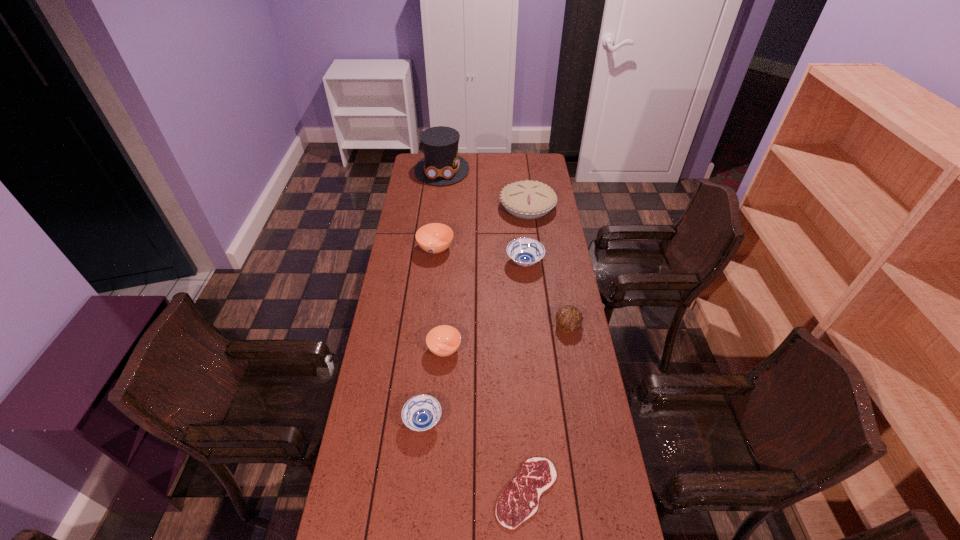
The width and height of the screenshot is (960, 540). Find the location of `free space located 0.200m on the front of the smaller blue soup bowl`. free space located 0.200m on the front of the smaller blue soup bowl is located at coordinates (415, 508).

Find the location of a particular element. The width and height of the screenshot is (960, 540). vacant space situated on the left of the red steak is located at coordinates (371, 492).

Identify the location of object present at the far edge. (441, 165).

You are a GUI agent. You are given a task and a screenshot of the screen. Output one action in this format:
    pyautogui.click(x=<x>, y=<y>)
    Task: Click on the dress hat that is at the left edge
    
    Given the screenshot: What is the action you would take?
    pyautogui.click(x=441, y=165)

The width and height of the screenshot is (960, 540). Identify the location of pie located at the right edge. (526, 199).

The image size is (960, 540). I want to click on soup bowl positioned at the right edge, so click(525, 252).

This screenshot has width=960, height=540. I want to click on muffin that is positioned at the right edge, so click(568, 318).

Where is `object positioned at the far left corner`? The image size is (960, 540). object positioned at the far left corner is located at coordinates 441,165.

In the image, there is a desktop. Where is `free space at the left edge`? free space at the left edge is located at coordinates (378, 326).

The height and width of the screenshot is (540, 960). I want to click on vacant space at the right edge, so click(554, 228).